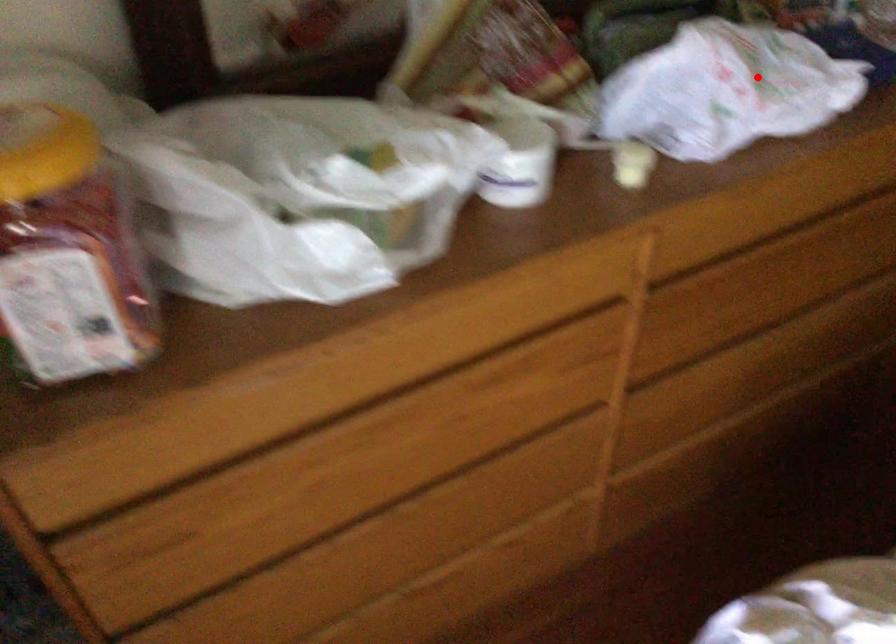
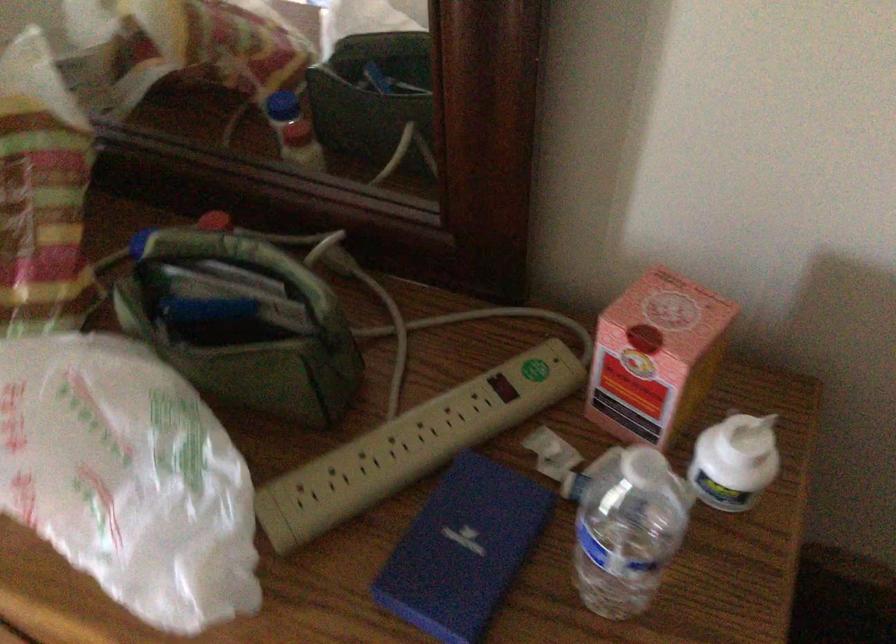
Locate, in the second image, the point that corresponds to the highlighted location in the first image.

(126, 478)